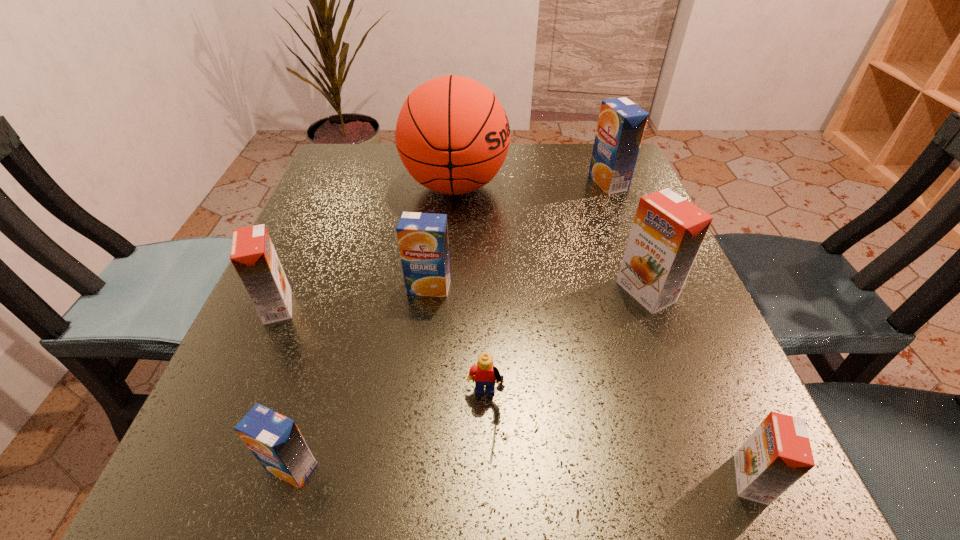
Locate an element on the screen. The image size is (960, 540). vacant space that satisfies the following two spatial constraints: 1. on the front side of the second blue orange_juice from right to left; 2. on the right side of the biggest orange orange juice is located at coordinates (428, 292).

The width and height of the screenshot is (960, 540). I want to click on free space that satisfies the following two spatial constraints: 1. on the front side of the farthest blue orange_juice; 2. on the side with logo of the tallest object, so click(610, 186).